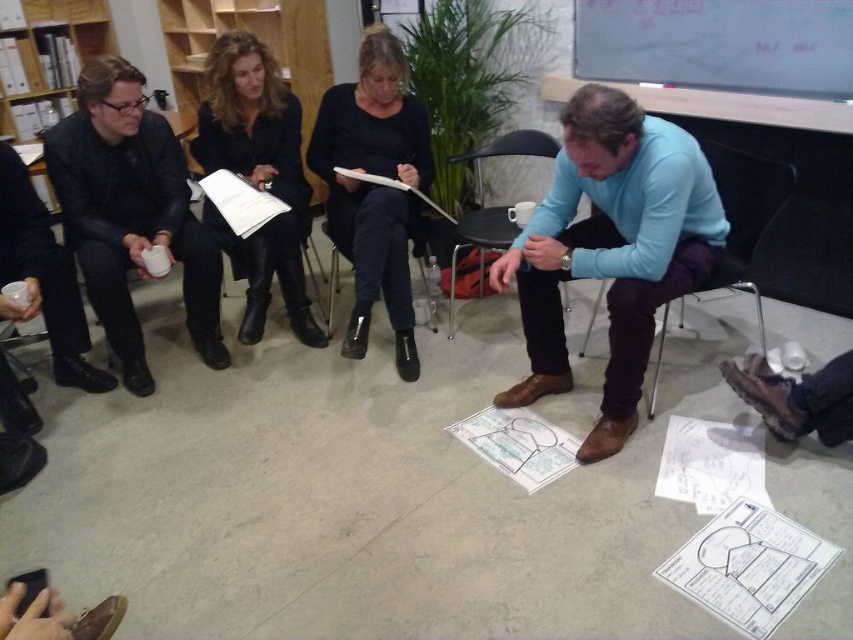
What do you see at coordinates (374, 188) in the screenshot? I see `black leather boots at center` at bounding box center [374, 188].

Can you confirm if black leather boots at center is shorter than black leather chair at center?

No.

Does point (379, 193) come closer to viewer compared to point (431, 205)?

Yes, it is.

In order to click on black leather boots at center in this screenshot , I will do `click(374, 188)`.

Which of these two, light blue sweater at center or velvet black jacket at upper center, stands shorter?

light blue sweater at center is shorter.

Between point (648, 316) and point (309, 340), which one is positioned behind?

The point (309, 340) is more distant.

At what (x,y) coordinates should I click in order to perform the action: click on light blue sweater at center. Please return your answer as a coordinate pair (x, y). The height and width of the screenshot is (640, 853). Looking at the image, I should click on (611, 248).

You are a GUI agent. You are given a task and a screenshot of the screen. Output one action in this format:
    pyautogui.click(x=<x>, y=<y>)
    Task: Click on the light blue sweater at center
    This screenshot has height=640, width=853.
    Given the screenshot: What is the action you would take?
    pyautogui.click(x=611, y=248)

Does white paper at lower center have a smaller size compared to metallic black chair at center?

Yes.

Can you confirm if white paper at lower center is bigger than metallic black chair at center?

No, white paper at lower center is not bigger than metallic black chair at center.

Who is more distant from viewer, (756, 564) or (759, 312)?

The point (759, 312) is behind.

What are the coordinates of `white paper at lower center` in the screenshot? It's located at coord(747,566).